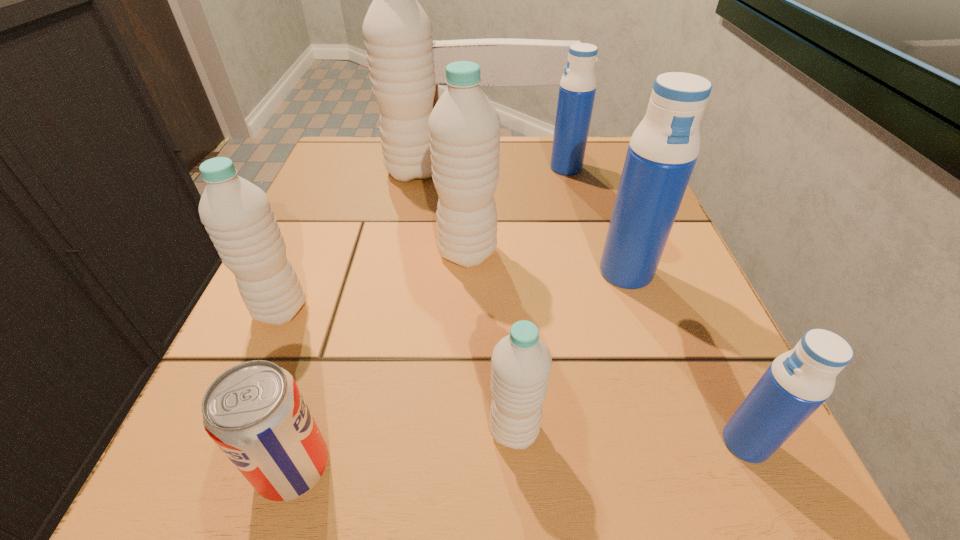
Select which water bottle is the third closest to the tallest water bottle. Please provide its 2D coordinates. Your answer should be formatted as a tuple, i.e. [(x, y)], where the tuple contains the x and y coordinates of a point satisfying the conditions above.

[(237, 215)]

Identify which white water bottle is located as the second nearest to the second nearest blue water bottle. Please provide its 2D coordinates. Your answer should be formatted as a tuple, i.e. [(x, y)], where the tuple contains the x and y coordinates of a point satisfying the conditions above.

[(521, 364)]

Where is `white water bottle that is the closest one to the biggest blue water bottle`? white water bottle that is the closest one to the biggest blue water bottle is located at coordinates (464, 127).

Select which blue water bottle is the closest to the farthest white water bottle. Please provide its 2D coordinates. Your answer should be formatted as a tuple, i.e. [(x, y)], where the tuple contains the x and y coordinates of a point satisfying the conditions above.

[(577, 89)]

Identify the location of blue water bottle that is the third nearest to the tallest object. (799, 381).

Identify the location of free space that satisfies the following two spatial constraints: 1. on the back side of the biggest blue water bottle; 2. on the right side of the soda. (352, 272).

Locate an element on the screen. vacant space that satisfies the following two spatial constraints: 1. on the back side of the nearest blue water bottle; 2. on the right side of the soda is located at coordinates (300, 442).